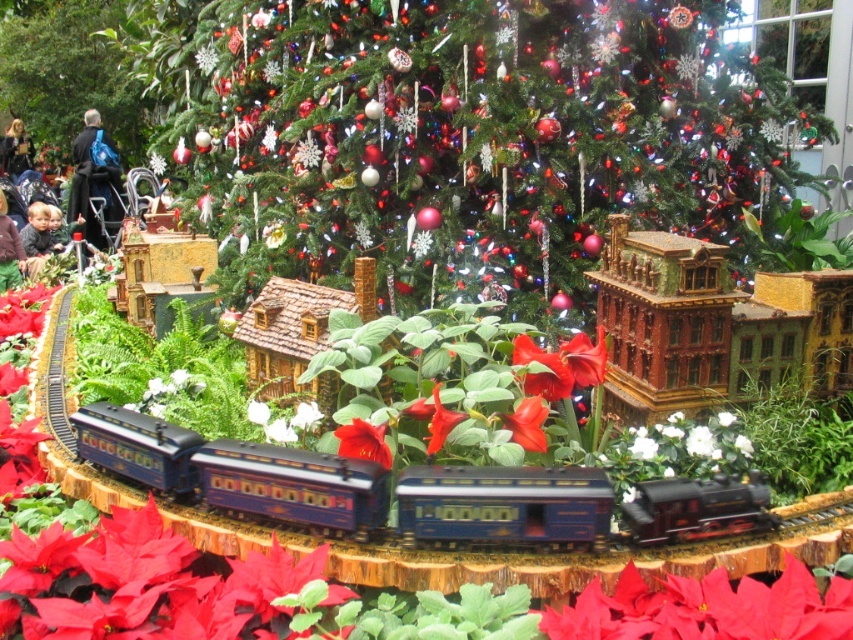
You are a child who wants to play with the shiny blue train at center and the dark brown leather jacket at upper left. Which object is shorter?

The shiny blue train at center is shorter than the dark brown leather jacket at upper left.

You are a child trying to see the green matte christmas tree at upper center but you are blocked by the dark blue backpack at left. Can you move the backpack to get a better view?

The green matte christmas tree at upper center is positioned over the dark blue backpack at left, so moving the dark blue backpack at left would allow you to see the tree better.